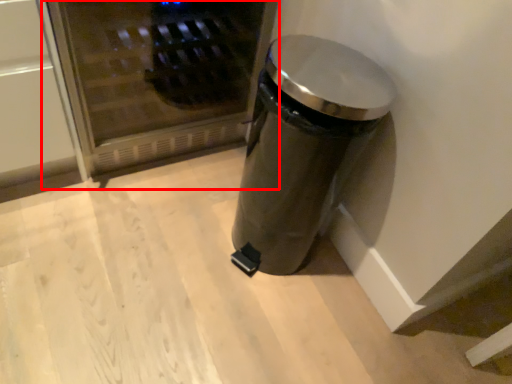
Question: From the image's perspective, considering the relative positions of microwave (annotated by the red box) and waste container in the image provided, where is microwave (annotated by the red box) located with respect to the staircase?

Choices:
 (A) below
 (B) above

Answer: (B)